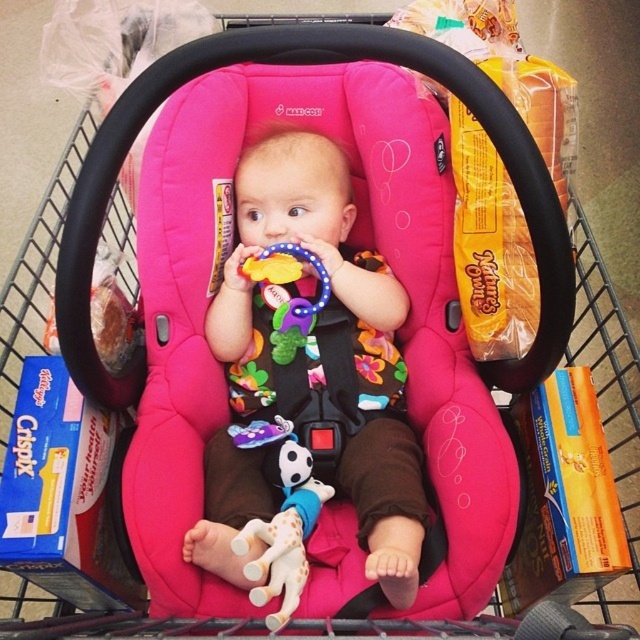
Is matte pink car seat at center bigger than white plush giraffe at center?

Yes.

Is point (394, 444) positioned in front of point (280, 589)?

No, it is behind (280, 589).

The width and height of the screenshot is (640, 640). I want to click on matte pink car seat at center, so click(353, 340).

Who is shorter, white plush giraffe at center or rubberized plastic teething ring at center?

rubberized plastic teething ring at center is shorter.

Between white plush giraffe at center and rubberized plastic teething ring at center, which one is positioned lower?

white plush giraffe at center is lower down.

Is point (266, 577) positioned before point (300, 260)?

Yes.

Where is `white plush giraffe at center`? white plush giraffe at center is located at coordinates [x=282, y=522].

Is matte pink car seat at center closer to the viewer compared to rubberized plastic teething ring at center?

That is True.

Is matte pink car seat at center further to camera compared to rubberized plastic teething ring at center?

No, it is in front of rubberized plastic teething ring at center.

Locate an element on the screen. matte pink car seat at center is located at coordinates (353, 340).

Image resolution: width=640 pixels, height=640 pixels. I want to click on matte pink car seat at center, so click(x=353, y=340).